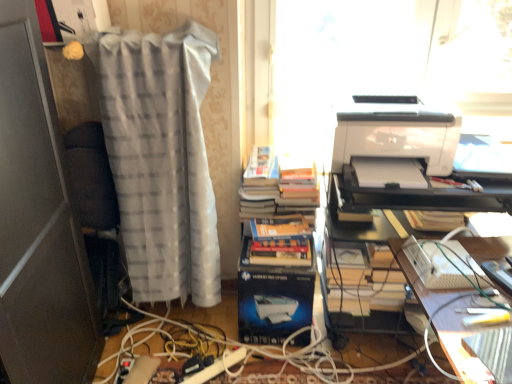
Where is `white sheer curtain at left`? The height and width of the screenshot is (384, 512). white sheer curtain at left is located at coordinates (162, 160).

This screenshot has height=384, width=512. Find the location of `white glossy printer at upper right`. white glossy printer at upper right is located at coordinates (388, 245).

I want to click on white glossy printer at right, so click(396, 131).

You are a GUI agent. You are given a task and a screenshot of the screen. Output one action in this format:
    pyautogui.click(x=<x>, y=<y>)
    Task: Click on the white plastic cable at lower center
    
    Given the screenshot: What is the action you would take?
    [x=272, y=372]

Find the location of a particular element. The image size is (512, 384). white sheer curtain at left is located at coordinates (162, 160).

From the image's perspective, would you say white glossy printer at upper right is positioned over blue glossy paperback book at center?

Indeed, from the image's perspective, white glossy printer at upper right is shown above blue glossy paperback book at center.

Is white glossy printer at upper right positioned far away from blue glossy paperback book at center?

They are positioned close to each other.

Looking at this image, is white glossy printer at upper right spatially inside blue glossy paperback book at center, or outside of it?

white glossy printer at upper right lies outside blue glossy paperback book at center.

Relative to blue glossy paperback book at center, is white glossy printer at upper right in front or behind?

In the image, white glossy printer at upper right appears in front of blue glossy paperback book at center.

Is point (508, 272) farther from viewer compared to point (402, 114)?

No, it is in front of (402, 114).

From the picture: From a real-world perspective, which object rests below the other?

metallic silver remote control at lower right, which appears as the 1th equipment when viewed from the right, from a real-world perspective.

Considering the sizes of objects metallic silver remote control at lower right, which appears as the 1th equipment when viewed from the right, and white glossy printer at right in the image provided, who is shorter, metallic silver remote control at lower right, which appears as the 1th equipment when viewed from the right, or white glossy printer at right?

metallic silver remote control at lower right, which appears as the 1th equipment when viewed from the right, is shorter.

Is metallic silver remote control at lower right, which appears as the 1th equipment when viewed from the right, behind white glossy printer at right?

No, it is in front of white glossy printer at right.

Does white glossy printer at upper right turn towards hardcover books at center?

No.

Is point (458, 322) closer or farther from the camera than point (307, 161)?

Point (458, 322) is closer to the camera than point (307, 161).

Does white glossy printer at upper right have a lesser height compared to hardcover books at center?

Incorrect, the height of white glossy printer at upper right does not fall short of that of hardcover books at center.

Is white glossy printer at upper right surrounding hardcover books at center?

No, hardcover books at center is located outside of white glossy printer at upper right.

You are a GUI agent. You are given a task and a screenshot of the screen. Output one action in this format:
    pyautogui.click(x=<x>, y=<y>)
    Task: Click on the file cabinet in front of the metallic silver remote control at lower right, which appears as the 1th equipment when viewed from the right
    This screenshot has height=384, width=512.
    Given the screenshot: What is the action you would take?
    pyautogui.click(x=38, y=223)

Is dark brown leather file cabinet at left completely or partially outside of metallic silver remote control at lower right, which appears as the 1th equipment when viewed from the right?

Absolutely, dark brown leather file cabinet at left is external to metallic silver remote control at lower right, which appears as the 1th equipment when viewed from the right.

Which of these two, dark brown leather file cabinet at left or metallic silver remote control at lower right, which ranks as the second equipment in left-to-right order, is thinner?

With smaller width is dark brown leather file cabinet at left.

Between dark brown leather file cabinet at left and metallic silver remote control at lower right, which appears as the 1th equipment when viewed from the right, which one has more height?

dark brown leather file cabinet at left.

Are white glossy printer at upper right and wooden desk at lower right far apart?

white glossy printer at upper right is actually quite close to wooden desk at lower right.

Considering the positions of point (286, 12) and point (448, 292), is point (286, 12) closer or farther from the camera than point (448, 292)?

Point (286, 12) is positioned farther from the camera compared to point (448, 292).

Which of these two, white glossy printer at upper right or wooden desk at lower right, stands shorter?

Standing shorter between the two is wooden desk at lower right.

Is white glossy printer at upper right oriented towards wooden desk at lower right?

Yes, white glossy printer at upper right is aimed at wooden desk at lower right.

Is metallic silver remote control at lower right, which appears as the 1th equipment when viewed from the right, with dark brown leather file cabinet at left?

No, metallic silver remote control at lower right, which appears as the 1th equipment when viewed from the right, is not beside dark brown leather file cabinet at left.

Is metallic silver remote control at lower right, which appears as the 1th equipment when viewed from the right, positioned with its back to dark brown leather file cabinet at left?

metallic silver remote control at lower right, which appears as the 1th equipment when viewed from the right, is not turned away from dark brown leather file cabinet at left.

From the picture: From a real-world perspective, is metallic silver remote control at lower right, which appears as the 1th equipment when viewed from the right, located beneath dark brown leather file cabinet at left?

Yes, from a real-world perspective, metallic silver remote control at lower right, which appears as the 1th equipment when viewed from the right, is below dark brown leather file cabinet at left.

From the image's perspective, is metallic silver remote control at lower right, which ranks as the second equipment in left-to-right order, over hardcover books at center?

No, from the image's perspective, metallic silver remote control at lower right, which ranks as the second equipment in left-to-right order, is not above hardcover books at center.

Is metallic silver remote control at lower right, which appears as the 1th equipment when viewed from the right, wider than hardcover books at center?

Incorrect, the width of metallic silver remote control at lower right, which appears as the 1th equipment when viewed from the right, does not surpass that of hardcover books at center.

Is point (502, 270) farther from viewer compared to point (262, 159)?

No, (502, 270) is in front of (262, 159).

Where is `paperback book lying below the white glossy printer at upper right (from the image's perspective)`? paperback book lying below the white glossy printer at upper right (from the image's perspective) is located at coordinates (272, 300).

Find the location of a particular element. The width and height of the screenshot is (512, 384). printer above the metallic silver remote control at lower right, which ranks as the second equipment in left-to-right order (from a real-world perspective) is located at coordinates (396, 131).

Based on their spatial positions, is dark brown leather file cabinet at left or white sheer curtain at left further from white glossy printer at right?

dark brown leather file cabinet at left is positioned further to the anchor white glossy printer at right.

Looking at the image, which one is located closer to blue glossy paperback book at center, white glossy printer at right or white plastic keyboard at lower right, the first equipment in the left-to-right sequence?

Based on the image, white plastic keyboard at lower right, the first equipment in the left-to-right sequence, appears to be nearer to blue glossy paperback book at center.

Consider the image. Considering their positions, is white glossy printer at upper right positioned closer to wooden desk at lower right than white sheer curtain at left?

white sheer curtain at left is closer to wooden desk at lower right.

From the image, which object appears to be nearer to hardcover books at center, white glossy printer at upper right or white glossy printer at right?

white glossy printer at upper right is closer to hardcover books at center.

Based on their spatial positions, is metallic silver remote control at lower right, which ranks as the second equipment in left-to-right order, or white plastic cable at lower center closer to dark brown leather file cabinet at left?

white plastic cable at lower center.

Looking at the image, which one is located further to white sheer curtain at left, hardcover books at center or white glossy printer at right?

The object further to white sheer curtain at left is white glossy printer at right.

Based on their spatial positions, is white plastic keyboard at lower right, which ranks as the 2th equipment in right-to-left order, or dark brown leather file cabinet at left closer to white glossy printer at upper right?

Based on the image, white plastic keyboard at lower right, which ranks as the 2th equipment in right-to-left order, appears to be nearer to white glossy printer at upper right.

When comparing their distances from hardcover books at center, does blue glossy paperback book at center or dark brown leather file cabinet at left seem further?

Based on the image, dark brown leather file cabinet at left appears to be further to hardcover books at center.

Locate an element on the screen. This screenshot has height=384, width=512. book between dark brown leather file cabinet at left and white glossy printer at upper right from left to right is located at coordinates (279, 210).

Locate an element on the screen. The width and height of the screenshot is (512, 384). equipment between white sheer curtain at left and metallic silver remote control at lower right, which appears as the 1th equipment when viewed from the right, in the horizontal direction is located at coordinates coord(444,264).

At what (x,y) coordinates should I click in order to perform the action: click on book between white glossy printer at right and wooden desk at lower right in the vertical direction. Please return your answer as a coordinate pair (x, y). The height and width of the screenshot is (384, 512). Looking at the image, I should click on (279, 210).

Where is `cable between dark brown leather file cabinet at left and white glossy printer at upper right`? cable between dark brown leather file cabinet at left and white glossy printer at upper right is located at coordinates (272, 372).